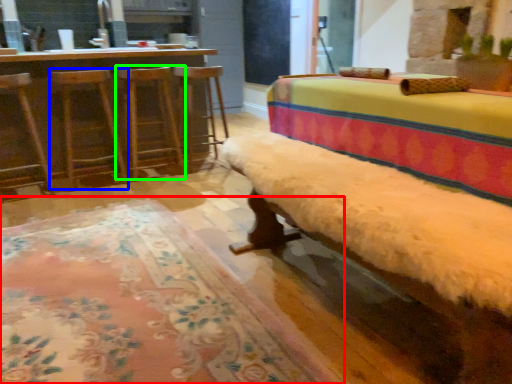
Question: Based on their relative distances, which object is nearer to mat (highlighted by a red box)? Choose from swivel chair (highlighted by a blue box) and bar stool (highlighted by a green box).

Choices:
 (A) swivel chair
 (B) bar stool

Answer: (A)